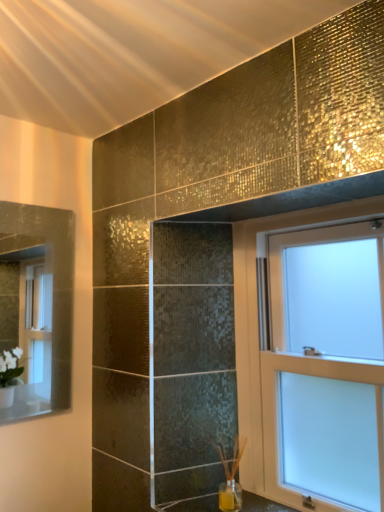
Question: Looking at their shapes, would you say clear glass mirror at left is wider or thinner than white frosted glass window at upper right?

Choices:
 (A) wide
 (B) thin

Answer: (B)

Question: Considering the positions of clear glass mirror at left and white frosted glass window at upper right in the image, is clear glass mirror at left bigger or smaller than white frosted glass window at upper right?

Choices:
 (A) big
 (B) small

Answer: (B)

Question: From the image's perspective, is clear glass mirror at left located above or below white frosted glass window at upper right?

Choices:
 (A) above
 (B) below

Answer: (A)

Question: Relative to clear glass mirror at left, is white frosted glass window at upper right in front or behind?

Choices:
 (A) front
 (B) behind

Answer: (A)

Question: Is white frosted glass window at upper right bigger or smaller than clear glass mirror at left?

Choices:
 (A) big
 (B) small

Answer: (A)

Question: In the image, is white frosted glass window at upper right on the left side or the right side of clear glass mirror at left?

Choices:
 (A) right
 (B) left

Answer: (A)

Question: From the image's perspective, is white frosted glass window at upper right above or below clear glass mirror at left?

Choices:
 (A) below
 (B) above

Answer: (A)